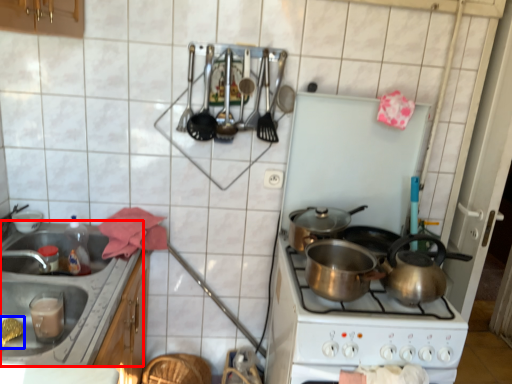
Question: Which of the following is the closest to the observer, sink (highlighted by a red box) or food (highlighted by a blue box)?

Choices:
 (A) sink
 (B) food

Answer: (A)